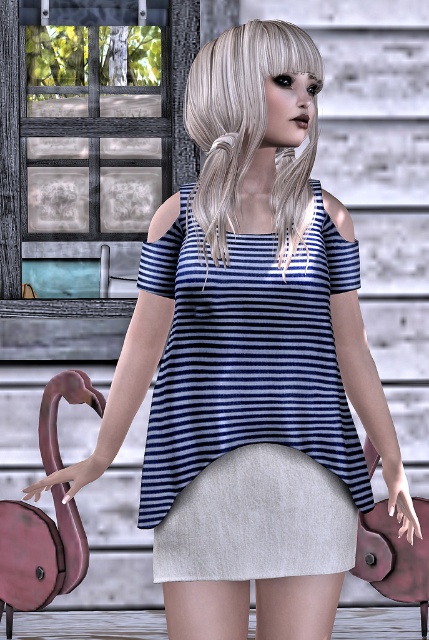
Between point (210, 326) and point (154, 531), which one is positioned behind?

The point (154, 531) is behind.

At what (x,y) coordinates should I click in order to perform the action: click on blue striped fabric dress at center. Please return your answer as a coordinate pair (x, y). Image resolution: width=429 pixels, height=640 pixels. Looking at the image, I should click on (247, 355).